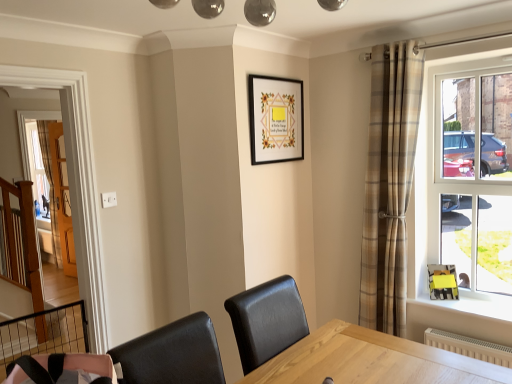
Question: Relative to black matte picture frame at upper center, is clear glass window at right in front or behind?

Choices:
 (A) front
 (B) behind

Answer: (A)

Question: Based on their positions, is clear glass window at right located to the left or right of black matte picture frame at upper center?

Choices:
 (A) left
 (B) right

Answer: (B)

Question: Based on their relative distances, which object is nearer to the black matte picture frame at upper center?

Choices:
 (A) white textured radiator at lower right
 (B) plaid fabric curtain at right
 (C) clear glass window at right
 (D) black metal balustrade at lower left

Answer: (B)

Question: Which object is positioned farthest from the clear glass window at right?

Choices:
 (A) plaid fabric curtain at right
 (B) black matte picture frame at upper center
 (C) white textured radiator at lower right
 (D) black metal balustrade at lower left

Answer: (D)